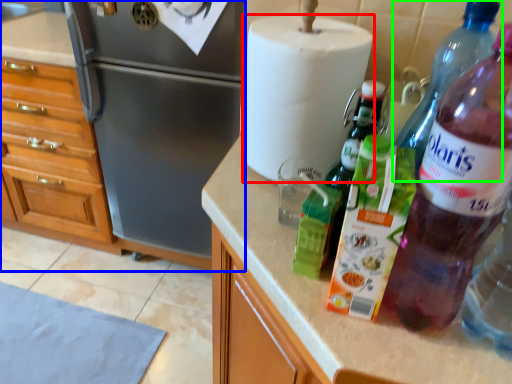
Question: Which object is the farthest from paper towel (highlighted by a red box)? Choose among these: cabinetry (highlighted by a blue box) or bottle (highlighted by a green box).

Choices:
 (A) cabinetry
 (B) bottle

Answer: (A)